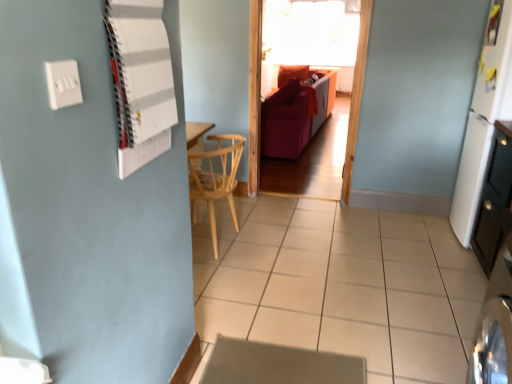
At what (x,y) coordinates should I click in order to perform the action: click on unoccupied region to the right of natural wood chair at center. Please return your answer as a coordinate pair (x, y). Looking at the image, I should click on (286, 242).